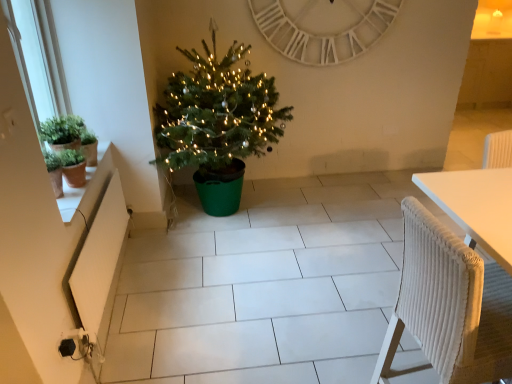
Question: Is white matte radiator at lower left outside green plastic christmas tree at center?

Choices:
 (A) no
 (B) yes

Answer: (B)

Question: From a real-world perspective, is white matte radiator at lower left positioned over green plastic christmas tree at center based on gravity?

Choices:
 (A) yes
 (B) no

Answer: (B)

Question: Is white matte radiator at lower left taller than green plastic christmas tree at center?

Choices:
 (A) yes
 (B) no

Answer: (B)

Question: Is green plastic christmas tree at center completely or partially inside white matte radiator at lower left?

Choices:
 (A) no
 (B) yes

Answer: (A)

Question: Is white matte radiator at lower left next to green plastic christmas tree at center?

Choices:
 (A) no
 (B) yes

Answer: (A)

Question: Does white matte radiator at lower left turn towards green plastic christmas tree at center?

Choices:
 (A) yes
 (B) no

Answer: (B)

Question: Is white wooden clock at upper center shorter than green matte pot at left?

Choices:
 (A) yes
 (B) no

Answer: (B)

Question: Is white wooden clock at upper center at the left side of green matte pot at left?

Choices:
 (A) no
 (B) yes

Answer: (A)

Question: Could you tell me if white wooden clock at upper center is facing green matte pot at left?

Choices:
 (A) no
 (B) yes

Answer: (A)

Question: Considering the relative positions of white wooden clock at upper center and green matte pot at left in the image provided, is white wooden clock at upper center to the right of green matte pot at left from the viewer's perspective?

Choices:
 (A) no
 (B) yes

Answer: (B)

Question: From a real-world perspective, is white wooden clock at upper center over green matte pot at left?

Choices:
 (A) no
 (B) yes

Answer: (B)

Question: Considering the relative sizes of white wooden clock at upper center and green matte pot at left in the image provided, is white wooden clock at upper center smaller than green matte pot at left?

Choices:
 (A) no
 (B) yes

Answer: (A)

Question: Considering the relative sizes of green plastic christmas tree at center and white matte radiator at lower left in the image provided, is green plastic christmas tree at center wider than white matte radiator at lower left?

Choices:
 (A) no
 (B) yes

Answer: (B)